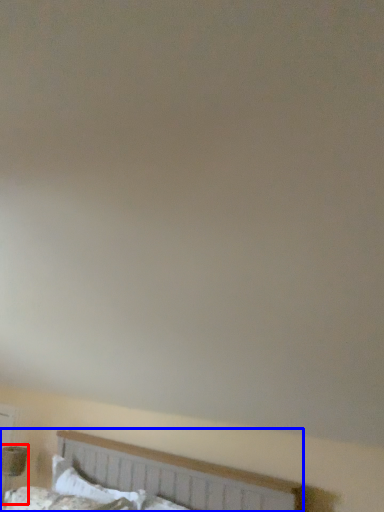
Question: Which of the following is the closest to the observer, table lamp (highlighted by a red box) or bed (highlighted by a blue box)?

Choices:
 (A) table lamp
 (B) bed

Answer: (B)